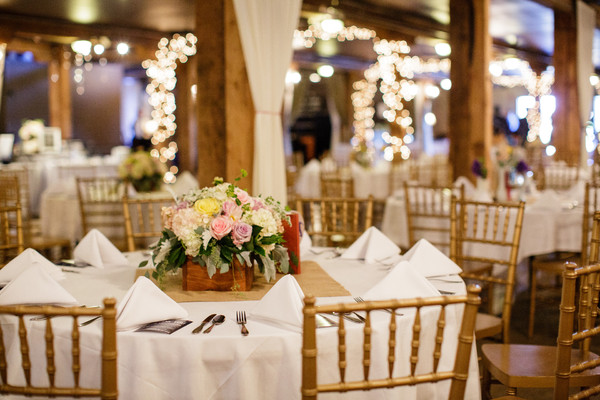
Identify the location of spoon. The height and width of the screenshot is (400, 600). (221, 320).